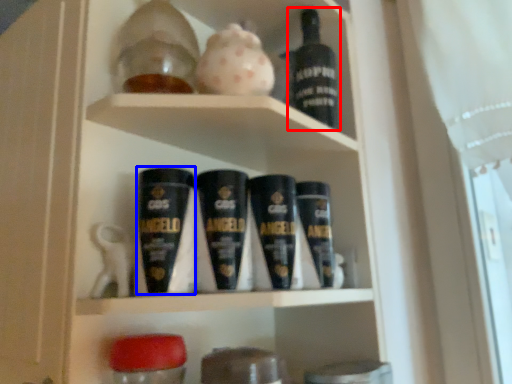
Question: Among these objects, which one is nearest to the camera, bottle (highlighted by a red box) or shaving cream (highlighted by a blue box)?

Choices:
 (A) bottle
 (B) shaving cream

Answer: (B)